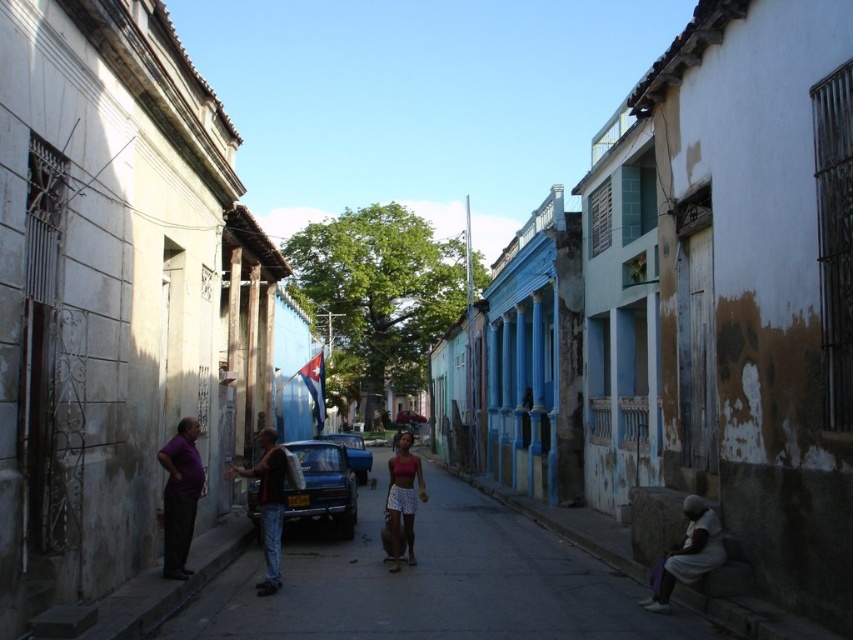
You are a delivery person with a 2.0 meter wide cart. You need to navigate through the narrow street scene shown in the image. The street has a smooth asphalt road at center and a matte pink tank top at center. Can your cart fit through the space between these two objects without touching them?

The distance between the smooth asphalt road at center and the matte pink tank top at center is 2.16 meters. Since your cart is 2.0 meters wide, there is enough space for it to pass through without touching either object.

You are a photographer standing at the end of the street. You want to take a photo that includes both point (309, 474) and point (355, 461). Which point will appear larger in the photo?

Point (309, 474) will appear larger in the photo because it is closer to the camera than point (355, 461).